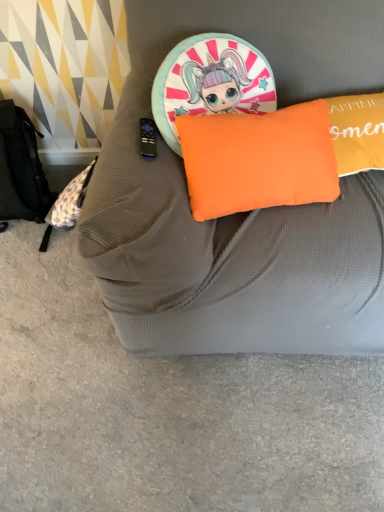
Question: Is orange fabric pillow at center shorter than orange fabric cushion at upper center?

Choices:
 (A) no
 (B) yes

Answer: (B)

Question: Does orange fabric pillow at center have a larger size compared to orange fabric cushion at upper center?

Choices:
 (A) yes
 (B) no

Answer: (B)

Question: Does orange fabric pillow at center have a greater height compared to orange fabric cushion at upper center?

Choices:
 (A) no
 (B) yes

Answer: (A)

Question: Considering the relative positions of orange fabric pillow at center and orange fabric cushion at upper center in the image provided, is orange fabric pillow at center to the right of orange fabric cushion at upper center from the viewer's perspective?

Choices:
 (A) yes
 (B) no

Answer: (B)

Question: Is orange fabric pillow at center smaller than orange fabric cushion at upper center?

Choices:
 (A) yes
 (B) no

Answer: (A)

Question: Could you tell me if orange fabric pillow at center is turned towards orange fabric cushion at upper center?

Choices:
 (A) yes
 (B) no

Answer: (A)

Question: Can you confirm if orange fabric cushion at upper center is shorter than orange fabric pillow at center?

Choices:
 (A) no
 (B) yes

Answer: (A)

Question: From the image's perspective, is orange fabric cushion at upper center located beneath orange fabric pillow at center?

Choices:
 (A) no
 (B) yes

Answer: (A)

Question: From a real-world perspective, does orange fabric cushion at upper center sit lower than orange fabric pillow at center?

Choices:
 (A) yes
 (B) no

Answer: (A)

Question: Considering the relative positions of orange fabric cushion at upper center and orange fabric pillow at center in the image provided, is orange fabric cushion at upper center to the left of orange fabric pillow at center from the viewer's perspective?

Choices:
 (A) yes
 (B) no

Answer: (B)

Question: Considering the relative sizes of orange fabric cushion at upper center and orange fabric pillow at center in the image provided, is orange fabric cushion at upper center smaller than orange fabric pillow at center?

Choices:
 (A) no
 (B) yes

Answer: (A)

Question: From the image's perspective, does orange fabric cushion at upper center appear higher than orange fabric pillow at center?

Choices:
 (A) yes
 (B) no

Answer: (A)

Question: Visually, is orange fabric cushion at upper center positioned to the left or to the right of orange fabric pillow at center?

Choices:
 (A) right
 (B) left

Answer: (A)